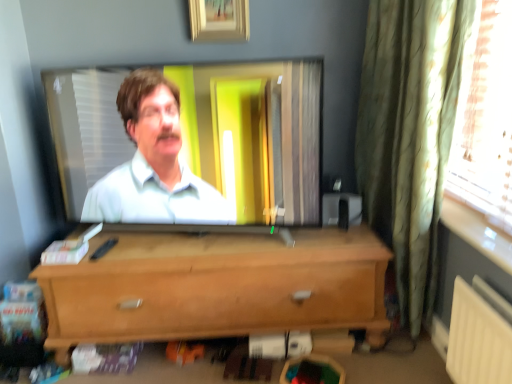
Question: From the image's perspective, is green textured curtain at right located above or below wooden picture frame at upper center?

Choices:
 (A) above
 (B) below

Answer: (B)

Question: Is green textured curtain at right in front of or behind wooden picture frame at upper center in the image?

Choices:
 (A) front
 (B) behind

Answer: (A)

Question: Estimate the real-world distances between objects in this image. Which object is closer to the green textured curtain at right?

Choices:
 (A) wooden picture frame at upper center
 (B) light brown wood chest of drawers at center

Answer: (B)

Question: Which is nearer to the green textured curtain at right?

Choices:
 (A) light brown wood chest of drawers at center
 (B) wooden picture frame at upper center

Answer: (A)